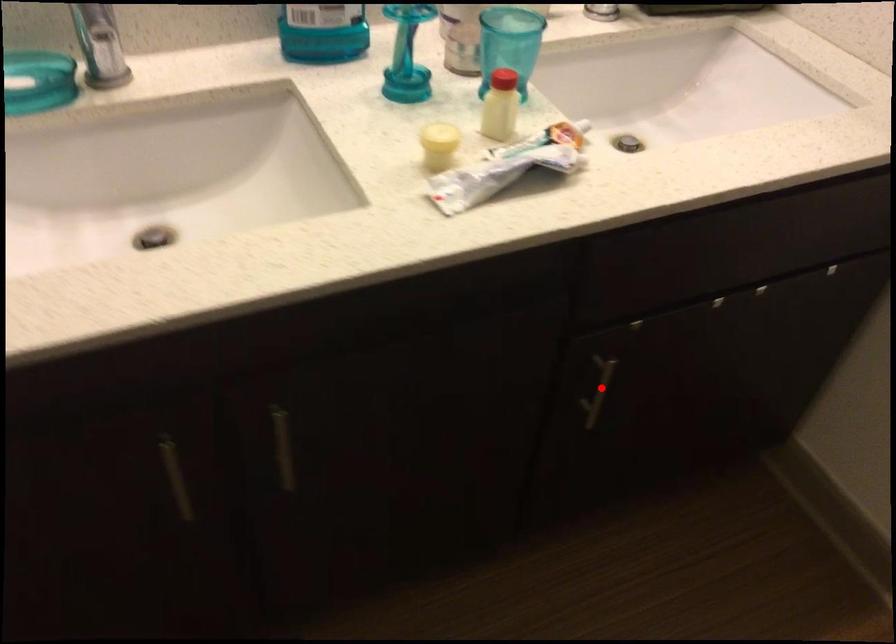
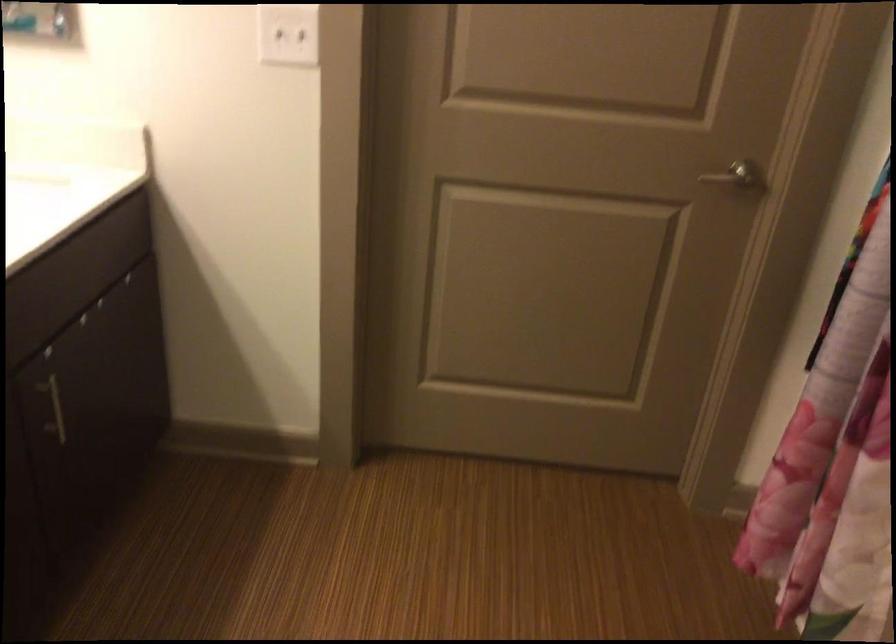
Locate, in the second image, the point that corresponds to the highlighted location in the first image.

(54, 409)